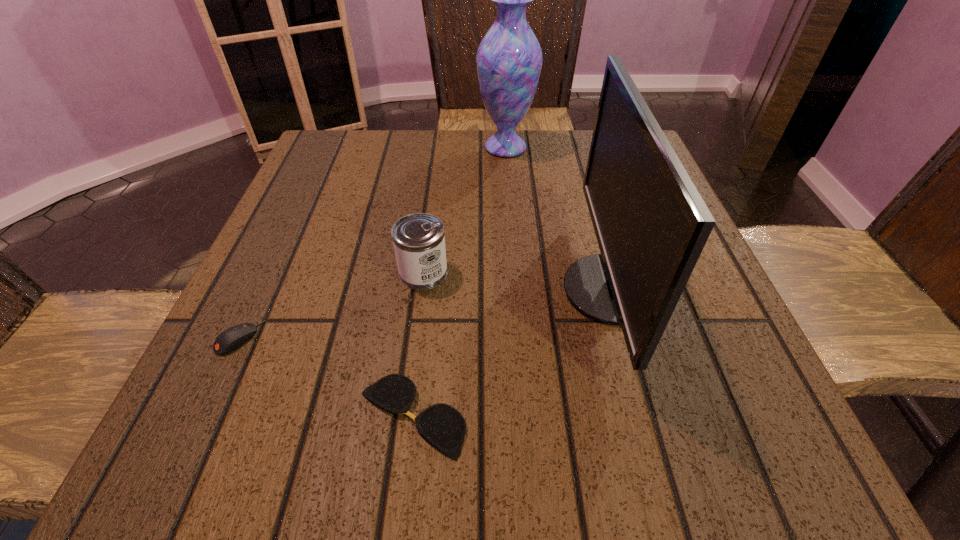
Find the location of a particular element. Image resolution: width=960 pixels, height=540 pixels. vacant space at the right edge is located at coordinates (676, 327).

This screenshot has width=960, height=540. I want to click on vacant area at the far left corner, so click(329, 184).

Where is `vacant space at the near right corner of the desktop`? This screenshot has width=960, height=540. vacant space at the near right corner of the desktop is located at coordinates (658, 421).

I want to click on free space between the third shortest object and the second object from right to left, so click(465, 210).

Locate an element on the screen. free space between the shortest object and the can is located at coordinates (418, 345).

In order to click on free space between the third tallest object and the rightmost object in this screenshot , I will do `click(516, 281)`.

Locate an element on the screen. blank region between the shortest object and the rightmost object is located at coordinates pos(512,353).

Find the location of `free area in between the third shortest object and the second shortest object`. free area in between the third shortest object and the second shortest object is located at coordinates (331, 305).

Image resolution: width=960 pixels, height=540 pixels. In order to click on empty space that is in between the can and the second object from right to left in this screenshot , I will do `click(465, 210)`.

Find the location of a particular element. This screenshot has height=540, width=960. empty space that is in between the fourth tallest object and the shortest object is located at coordinates (325, 377).